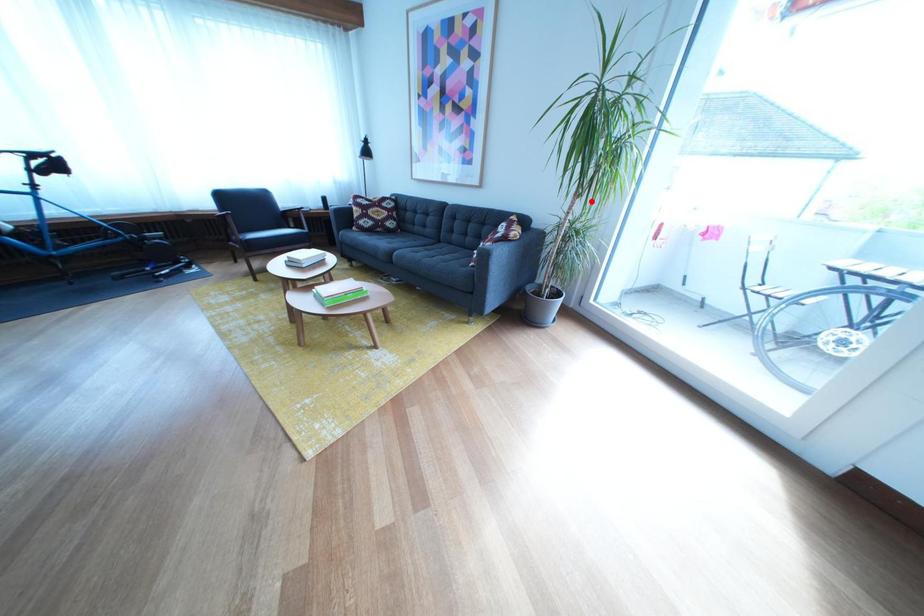
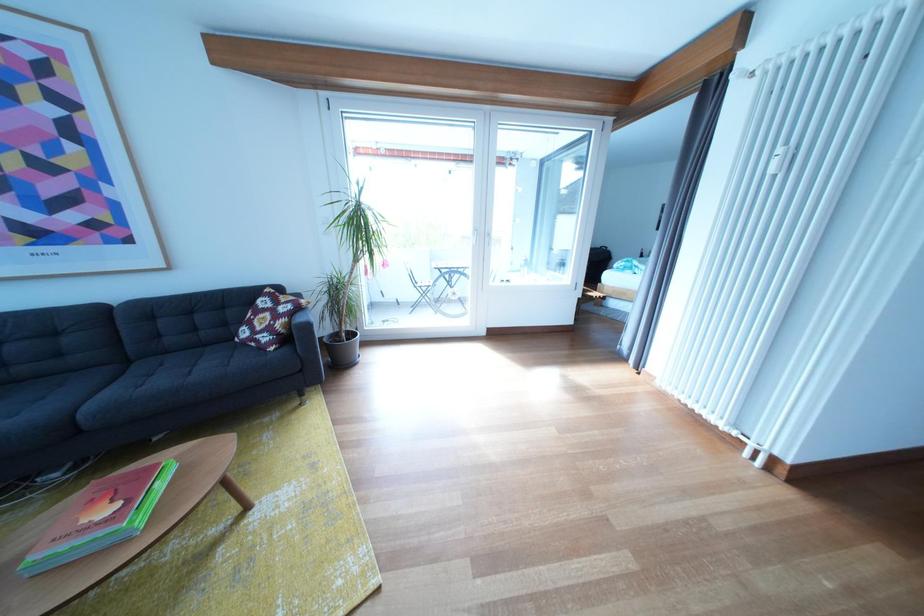
Question: I am providing you with two images of the same scene from different viewpoints. Image1 has a red point marked. In image2, the corresponding 3D location appears at what relative position? Reply with the corresponding letter.

Choices:
 (A) Closer
 (B) Farther

Answer: (A)